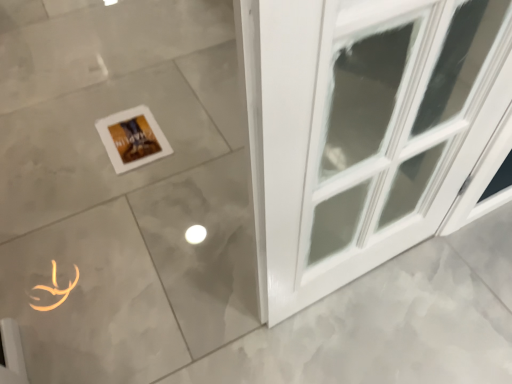
Question: Is matte gray tile at center taller or shorter than white matte picture frame at center?

Choices:
 (A) tall
 (B) short

Answer: (A)

Question: Is matte gray tile at center in front of or behind white matte picture frame at center in the image?

Choices:
 (A) behind
 (B) front

Answer: (B)

Question: Considering the positions of point (29, 249) and point (128, 110), is point (29, 249) closer or farther from the camera than point (128, 110)?

Choices:
 (A) closer
 (B) farther

Answer: (A)

Question: Relative to matte gray tile at center, is white matte picture frame at center in front or behind?

Choices:
 (A) front
 (B) behind

Answer: (B)

Question: In terms of height, does white matte picture frame at center look taller or shorter compared to matte gray tile at center?

Choices:
 (A) short
 (B) tall

Answer: (A)

Question: In terms of width, does white matte picture frame at center look wider or thinner when compared to matte gray tile at center?

Choices:
 (A) thin
 (B) wide

Answer: (A)

Question: Is white matte picture frame at center inside or outside of matte gray tile at center?

Choices:
 (A) outside
 (B) inside

Answer: (B)